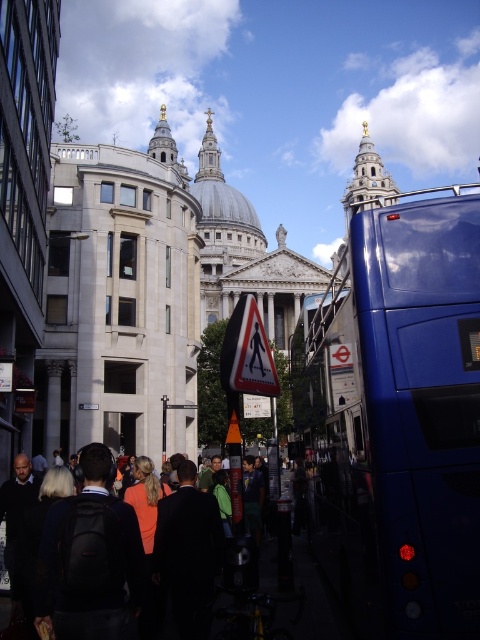
Does blue metallic bus at right have a lesser width compared to dark gray fabric crowd at lower left?

In fact, blue metallic bus at right might be wider than dark gray fabric crowd at lower left.

Is blue metallic bus at right bigger than dark gray fabric crowd at lower left?

Yes.

Who is more distant from viewer, (420, 349) or (120, 500)?

Positioned behind is point (120, 500).

You are a GUI agent. You are given a task and a screenshot of the screen. Output one action in this format:
    pyautogui.click(x=<x>, y=<y>)
    Task: Click on the blue metallic bus at right
    
    Given the screenshot: What is the action you would take?
    pyautogui.click(x=397, y=419)

Does dark gray fabric crowd at lower left appear under black matte backpack at lower left?

Indeed, dark gray fabric crowd at lower left is positioned under black matte backpack at lower left.

What do you see at coordinates (93, 563) in the screenshot? Image resolution: width=480 pixels, height=640 pixels. I see `dark gray fabric crowd at lower left` at bounding box center [93, 563].

Who is more distant from viewer, (56, 529) or (58, 512)?

The point (58, 512) is more distant.

I want to click on dark gray fabric crowd at lower left, so click(93, 563).

Does black matte backpack at lower left have a lesser width compared to white plastic pedestrian sign at center?

No.

At what (x,y) coordinates should I click in order to perform the action: click on black matte backpack at lower left. Please return your answer as a coordinate pair (x, y). Looking at the image, I should click on (90, 557).

Is point (98, 632) positioned before point (239, 339)?

Yes.

Find the location of a particular element. The width and height of the screenshot is (480, 640). black matte backpack at lower left is located at coordinates pyautogui.click(x=90, y=557).